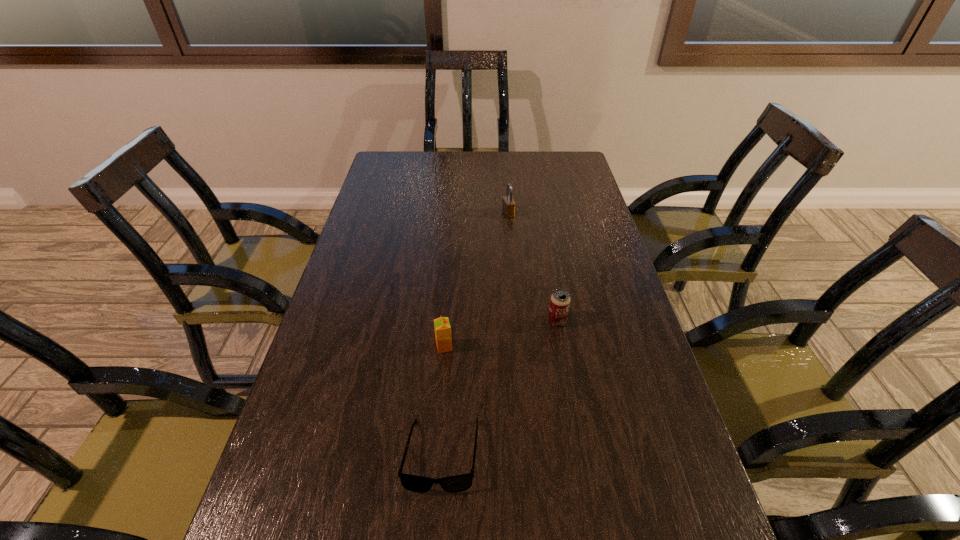
You are a GUI agent. You are given a task and a screenshot of the screen. Output one action in this format:
    pyautogui.click(x=<x>, y=<y>)
    Task: Click on the vacant space in between the orange juice and the shortest object
    Image resolution: width=960 pixels, height=540 pixels.
    Given the screenshot: What is the action you would take?
    pyautogui.click(x=443, y=401)

The image size is (960, 540). In order to click on free point between the nearest object and the tallest object in this screenshot , I will do `click(475, 334)`.

Identify the location of free spot between the padlock and the shortest object. (475, 334).

This screenshot has height=540, width=960. What are the coordinates of `vacant region between the sunglasses and the beer can` in the screenshot? It's located at (499, 388).

Where is `the second closest object to the farthest object`? The image size is (960, 540). the second closest object to the farthest object is located at coordinates (442, 327).

Where is `object that stands as the closest to the beer can`? The height and width of the screenshot is (540, 960). object that stands as the closest to the beer can is located at coordinates (442, 327).